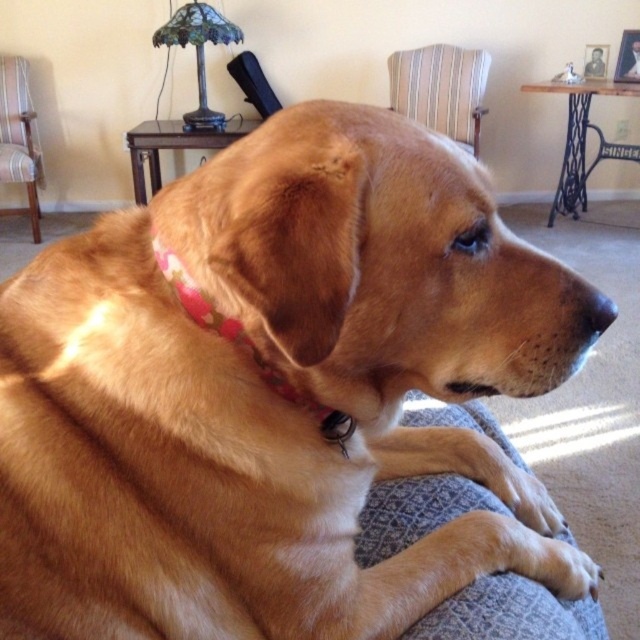
Question: Can you confirm if gray fabric dog bed at lower center is thinner than striped fabric armchair at left?

Choices:
 (A) no
 (B) yes

Answer: (B)

Question: Which of the following is the farthest from the observer?

Choices:
 (A) striped fabric armchair at upper center
 (B) floral fabric bandana at center
 (C) gray fabric dog bed at lower center
 (D) striped fabric armchair at left

Answer: (A)

Question: Does gray fabric dog bed at lower center appear on the left side of striped fabric armchair at upper center?

Choices:
 (A) yes
 (B) no

Answer: (A)

Question: Can you confirm if gray fabric dog bed at lower center is positioned above striped fabric armchair at left?

Choices:
 (A) no
 (B) yes

Answer: (A)

Question: Which of the following is the farthest from the observer?

Choices:
 (A) floral fabric bandana at center
 (B) gray fabric dog bed at lower center

Answer: (B)

Question: Considering the real-world distances, which object is farthest from the striped fabric armchair at left?

Choices:
 (A) floral fabric bandana at center
 (B) gray fabric dog bed at lower center
 (C) striped fabric armchair at upper center

Answer: (A)